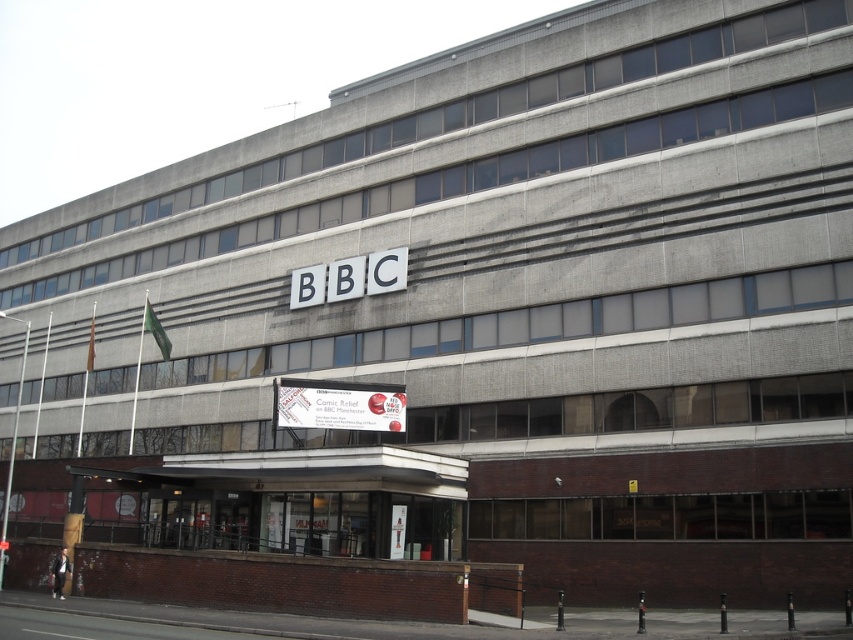
Consider the image. You are a window cleaner standing on a platform that can only reach up to 20 feet. You need to clean both the white plastic sign at center and the white plastic bbc sign at center. Which sign should you clean first based on your platform height limit?

The distance between the white plastic sign at center and the white plastic bbc sign at center is 23.76 feet. Since your platform can only reach up to 20 feet, you cannot reach both signs simultaneously. You should clean whichever sign is lower first, but the exact vertical position isn

You are standing in front of the BBC Manchester headquarters. You notice two signs on the building. One is the white plastic sign at center and the other is the white plastic BBC sign at center. Which sign is closer to you?

The white plastic sign at center is in front of the white plastic BBC sign at center, so the white plastic sign at center is closer to you.